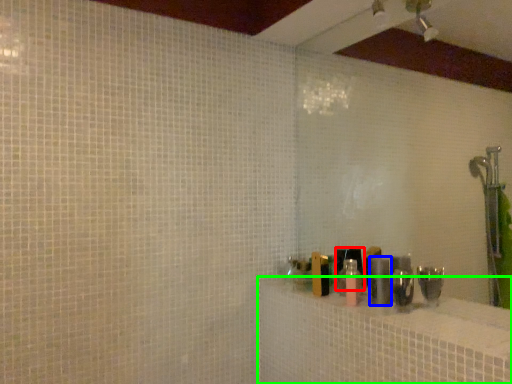
Question: Based on their relative distances, which object is farther from toiletry (highlighted by a red box)? Choose from toiletry (highlighted by a blue box) and bath (highlighted by a green box).

Choices:
 (A) toiletry
 (B) bath

Answer: (B)